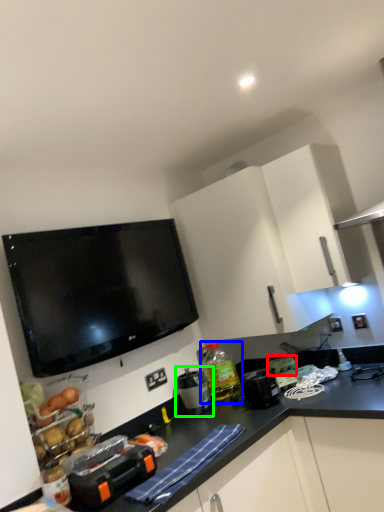
Question: Which object is positioned closest to appliance (highlighted by a red box)? Select from bottle (highlighted by a blue box) and appliance (highlighted by a green box).

Choices:
 (A) bottle
 (B) appliance

Answer: (A)